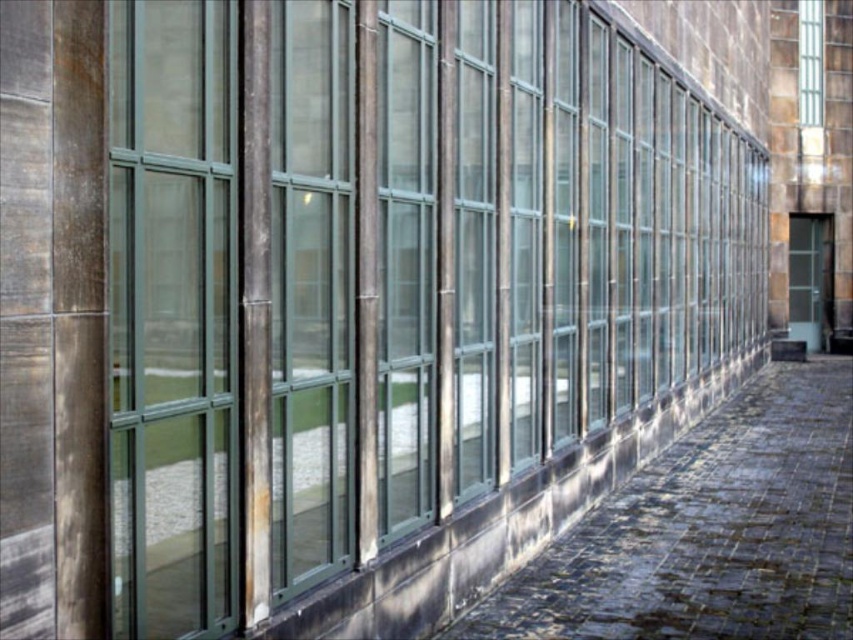
Question: Among these objects, which one is farthest from the camera?

Choices:
 (A) clear glass door at right
 (B) dark gray cobblestone at center

Answer: (A)

Question: Is dark gray cobblestone at center above clear glass door at right?

Choices:
 (A) yes
 (B) no

Answer: (B)

Question: Is the position of dark gray cobblestone at center more distant than that of clear glass door at right?

Choices:
 (A) no
 (B) yes

Answer: (A)

Question: Is dark gray cobblestone at center closer to camera compared to clear glass door at right?

Choices:
 (A) no
 (B) yes

Answer: (B)